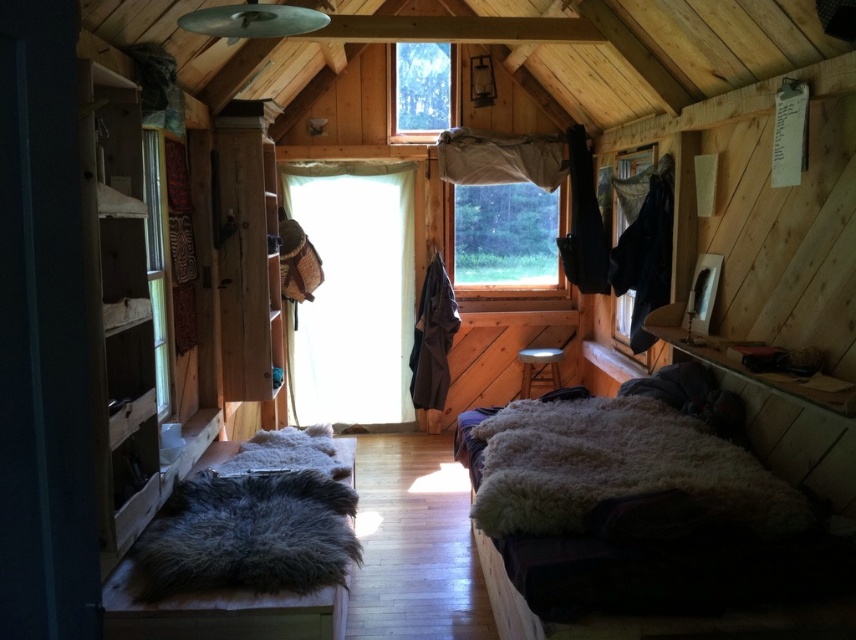
You are standing in the cabin and want to determine which of the two points, point (479,244) or point (627,307), is closer to you. Based on the spatial relationship between them, which point is nearer?

Point (479,244) is further to the viewer than point (627,307), so the closer point to you is point (627,307).

You are standing in the cabin and want to hang a picture frame on the wall behind the transparent fabric at center and the transparent fabric at right. Which fabric should you aim for to place the frame closer to you?

The transparent fabric at center is closer to you, so you should aim for it to place the frame closer to you.

You are standing in the cabin and want to reach the point marked at coordinates (520, 406). The cabin has a door 2.5 meters away from you. Can you walk straight to the point without passing through the door?

The point is 3.22 meters away from you, which is farther than the door at 2.5 meters. Therefore, walking straight to the point would require passing through the door first.